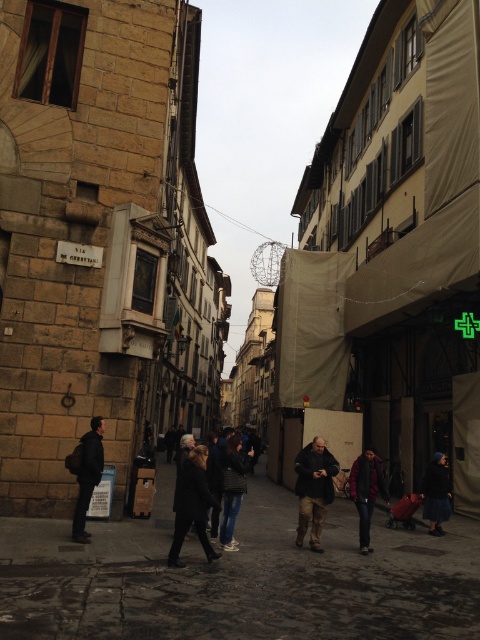
Does dark red jacket at center appear on the left side of dark blue fabric coat at lower right?

Yes, dark red jacket at center is to the left of dark blue fabric coat at lower right.

The height and width of the screenshot is (640, 480). Identify the location of dark red jacket at center. (365, 492).

Locate an element on the screen. dark red jacket at center is located at coordinates (365, 492).

What do you see at coordinates (313, 488) in the screenshot? This screenshot has width=480, height=640. I see `dark brown leather jacket at center` at bounding box center [313, 488].

Does dark brown leather jacket at center have a lesser height compared to dark gray backpack at left?

No.

The width and height of the screenshot is (480, 640). In order to click on dark brown leather jacket at center in this screenshot , I will do `click(313, 488)`.

This screenshot has width=480, height=640. What are the coordinates of `dark brown leather jacket at center` in the screenshot? It's located at (313, 488).

Can you confirm if dark gray stone alley at center is wider than dark gray coat at center?

Yes, dark gray stone alley at center is wider than dark gray coat at center.

Is the position of dark gray stone alley at center less distant than that of dark gray coat at center?

Yes, dark gray stone alley at center is closer to the viewer.

Which is in front, point (288, 548) or point (192, 513)?

Positioned in front is point (192, 513).

Where is `dark gray stone alley at center`? The width and height of the screenshot is (480, 640). dark gray stone alley at center is located at coordinates (239, 579).